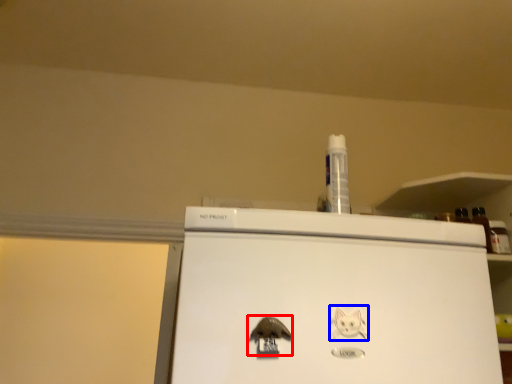
Question: Which object appears closest to the camera in this image, animal (highlighted by a red box) or animal (highlighted by a blue box)?

Choices:
 (A) animal
 (B) animal

Answer: (A)